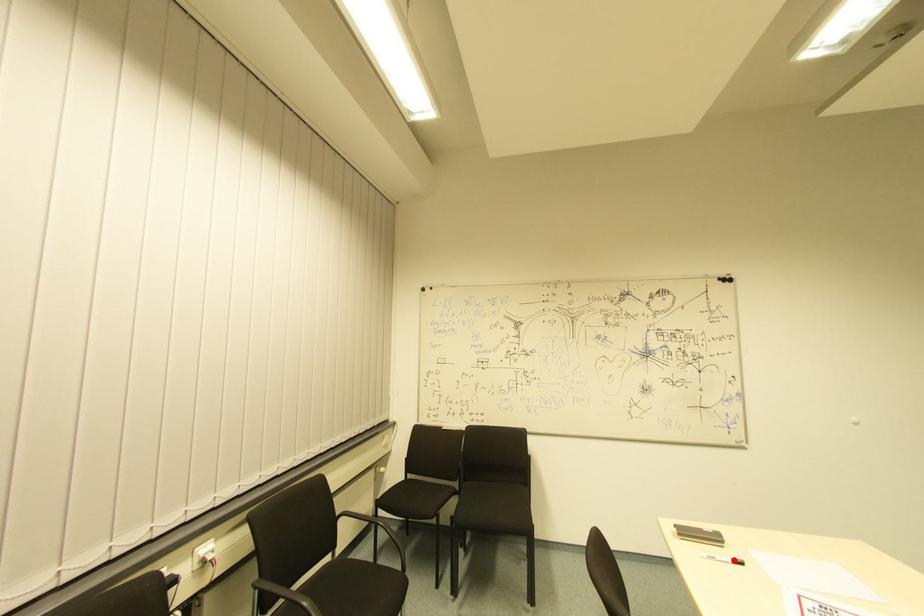
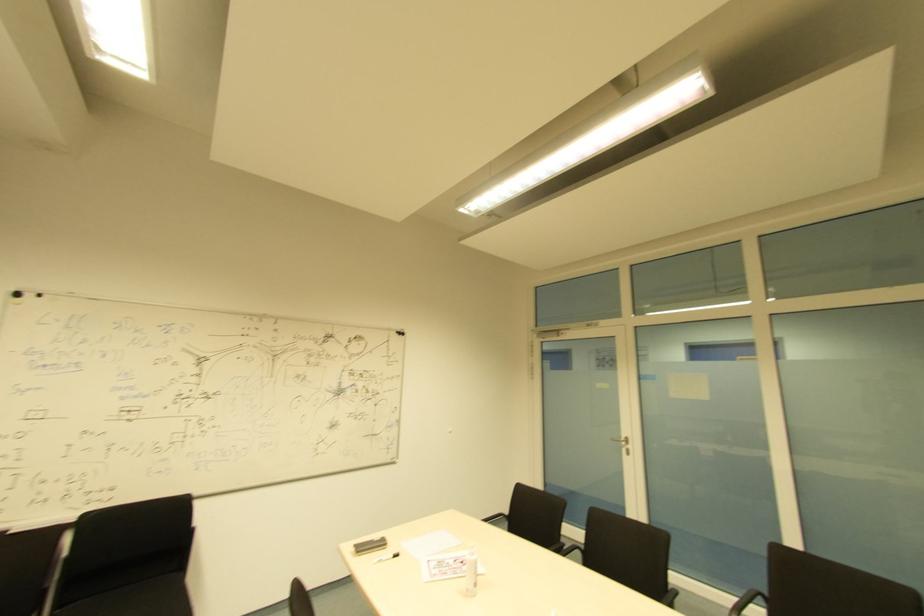
In the second image, find the point that corresponds to the highlighted location in the first image.

(394, 554)